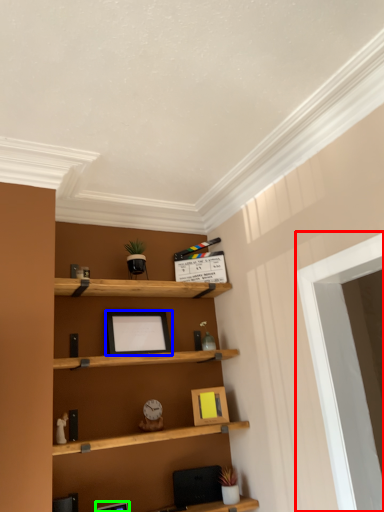
Question: Based on their relative distances, which object is farther from window (highlighted by a red box)? Choose from picture frame (highlighted by a blue box) and picture frame (highlighted by a green box).

Choices:
 (A) picture frame
 (B) picture frame

Answer: (B)